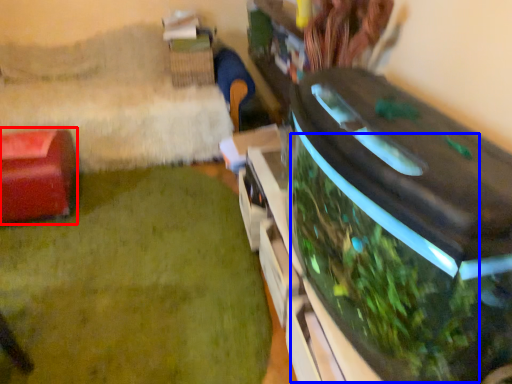
Question: Among these objects, which one is nearest to the camera, furniture (highlighted by a red box) or vegetation (highlighted by a blue box)?

Choices:
 (A) furniture
 (B) vegetation

Answer: (B)